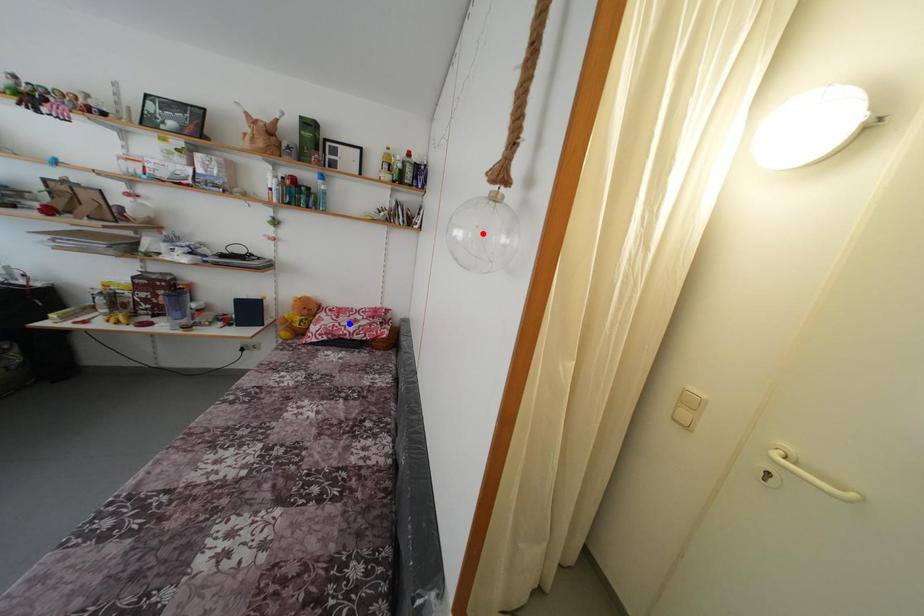
Question: Which of the two points in the image is closer to the camera?

Choices:
 (A) Blue point is closer.
 (B) Red point is closer.

Answer: (B)